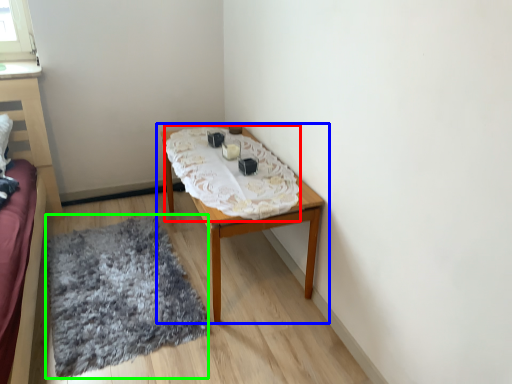
Question: Estimate the real-world distances between objects in this image. Which object is closer to blanket (highlighted by a red box), table (highlighted by a blue box) or mat (highlighted by a green box)?

Choices:
 (A) table
 (B) mat

Answer: (A)